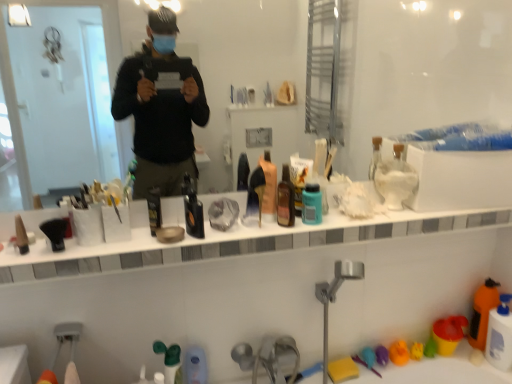
Question: Is white matte bottle at upper center, which appears as the third cleaning product when ordered from the bottom, smaller than transparent glass mirror at upper center?

Choices:
 (A) yes
 (B) no

Answer: (A)

Question: Is white matte bottle at upper center, positioned as the first cleaning product in top-to-bottom order, behind transparent glass mirror at upper center?

Choices:
 (A) no
 (B) yes

Answer: (B)

Question: Considering the relative positions of white matte bottle at upper center, positioned as the first cleaning product in top-to-bottom order, and transparent glass mirror at upper center in the image provided, is white matte bottle at upper center, positioned as the first cleaning product in top-to-bottom order, to the left of transparent glass mirror at upper center from the viewer's perspective?

Choices:
 (A) no
 (B) yes

Answer: (A)

Question: From the image's perspective, is white matte bottle at upper center, arranged as the first cleaning product when viewed from the left, on top of transparent glass mirror at upper center?

Choices:
 (A) no
 (B) yes

Answer: (A)

Question: From the image's perspective, is white matte bottle at upper center, arranged as the first cleaning product when viewed from the left, below transparent glass mirror at upper center?

Choices:
 (A) no
 (B) yes

Answer: (B)

Question: From the image's perspective, is brown glass bottle at center, the second mouthwash in the right-to-left sequence, located above or below transparent glass mirror at upper center?

Choices:
 (A) below
 (B) above

Answer: (A)

Question: Considering the positions of brown glass bottle at center, the second mouthwash in the left-to-right sequence, and transparent glass mirror at upper center in the image, is brown glass bottle at center, the second mouthwash in the left-to-right sequence, bigger or smaller than transparent glass mirror at upper center?

Choices:
 (A) small
 (B) big

Answer: (A)

Question: Considering the positions of brown glass bottle at center, the second mouthwash in the right-to-left sequence, and transparent glass mirror at upper center in the image, is brown glass bottle at center, the second mouthwash in the right-to-left sequence, taller or shorter than transparent glass mirror at upper center?

Choices:
 (A) short
 (B) tall

Answer: (A)

Question: Based on their positions, is brown glass bottle at center, the second mouthwash in the left-to-right sequence, located to the left or right of transparent glass mirror at upper center?

Choices:
 (A) left
 (B) right

Answer: (B)

Question: From the image's perspective, is translucent plastic bottle at lower center, arranged as the 1th toiletry when viewed from the right, above or below yellow rubber duck at lower right, positioned as the third toy in left-to-right order?

Choices:
 (A) above
 (B) below

Answer: (B)

Question: In terms of width, does translucent plastic bottle at lower center, which ranks as the fourth toiletry in left-to-right order, look wider or thinner when compared to yellow rubber duck at lower right, positioned as the third toy in left-to-right order?

Choices:
 (A) thin
 (B) wide

Answer: (A)

Question: From a real-world perspective, relative to yellow rubber duck at lower right, positioned as the third toy in left-to-right order, is translucent plastic bottle at lower center, which ranks as the fourth toiletry in top-to-bottom order, vertically above or below?

Choices:
 (A) below
 (B) above

Answer: (B)

Question: Relative to yellow rubber duck at lower right, positioned as the third toy in left-to-right order, is translucent plastic bottle at lower center, which ranks as the fourth toiletry in left-to-right order, in front or behind?

Choices:
 (A) front
 (B) behind

Answer: (A)

Question: From a real-world perspective, is white glossy counter top at center positioned above or below translucent plastic bottle at lower right, which is the 3th cleaning product from top to bottom?

Choices:
 (A) below
 (B) above

Answer: (B)

Question: Considering their positions, is white glossy counter top at center located in front of or behind translucent plastic bottle at lower right, which is the 1th cleaning product in right-to-left order?

Choices:
 (A) behind
 (B) front

Answer: (B)